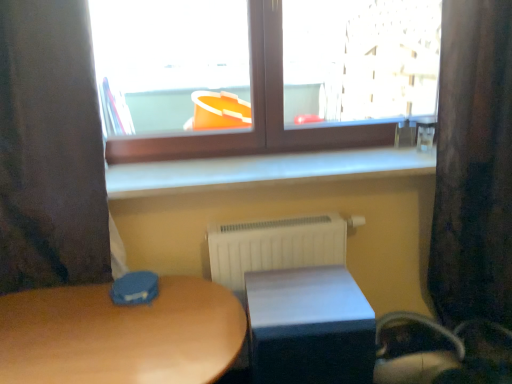
Identify the location of free point above white matte table at lower center, acting as the 2th table starting from the left (from a real-world perspective). (315, 297).